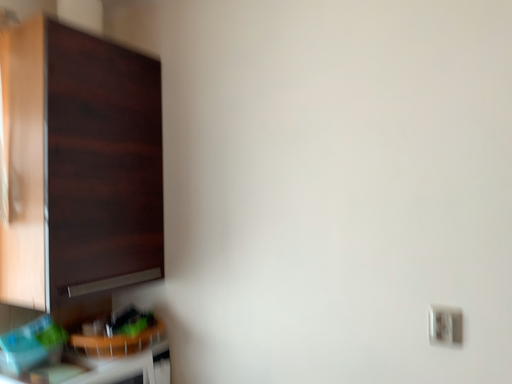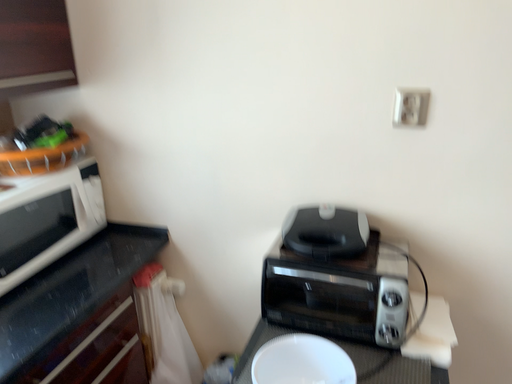
Question: Which way did the camera rotate in the video?

Choices:
 (A) rotated downward
 (B) rotated upward

Answer: (A)